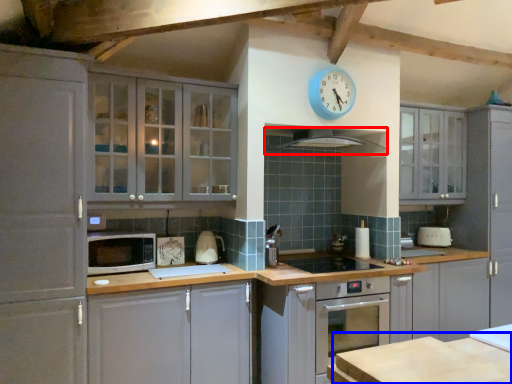
Question: Which point is closer to the camera, exhaust hood (highlighted by a red box) or table (highlighted by a blue box)?

Choices:
 (A) exhaust hood
 (B) table

Answer: (B)